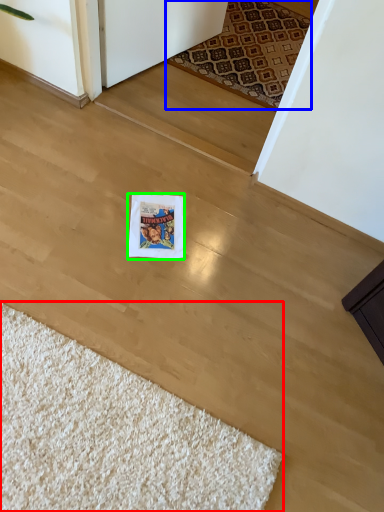
Question: Based on their relative distances, which object is nearer to doormat (highlighted by a red box)? Choose from mat (highlighted by a blue box) and postcard (highlighted by a green box).

Choices:
 (A) mat
 (B) postcard

Answer: (B)